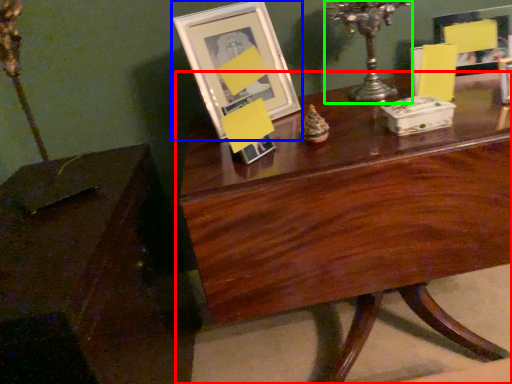
Question: Estimate the real-world distances between objects in this image. Which object is closer to table (highlighted by a red box), picture frame (highlighted by a blue box) or candle holder (highlighted by a green box)?

Choices:
 (A) picture frame
 (B) candle holder

Answer: (A)